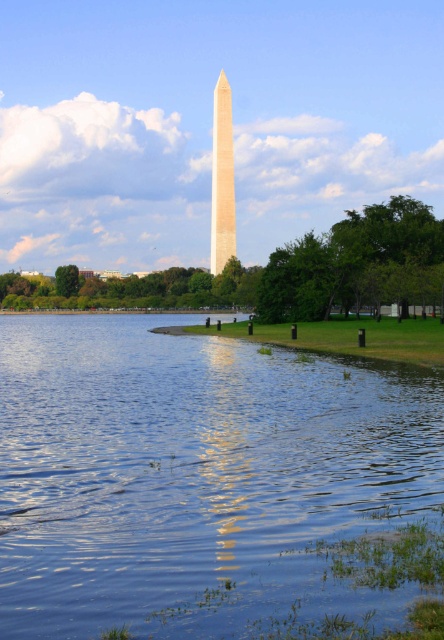
You are a tourist standing on the grassy area near the trees in the midground of the image. You want to take a photo of the beige stone obelisk at center with its reflection in the blue glassy water at center. Can you do this without moving from your current position?

The blue glassy water at center and beige stone obelisk at center are 148.14 meters apart. Since the water is directly below the obelisk, you can capture both in one frame from your current position on the grassy area near the trees in the midground.

Looking at this image, you are planning to take a photo of the beige stone obelisk at center and the blue glassy water at center from the left side of the image. Which object will appear wider in the photo?

The blue glassy water at center appears wider in the photo because its width is larger than the beige stone obelisk at center.